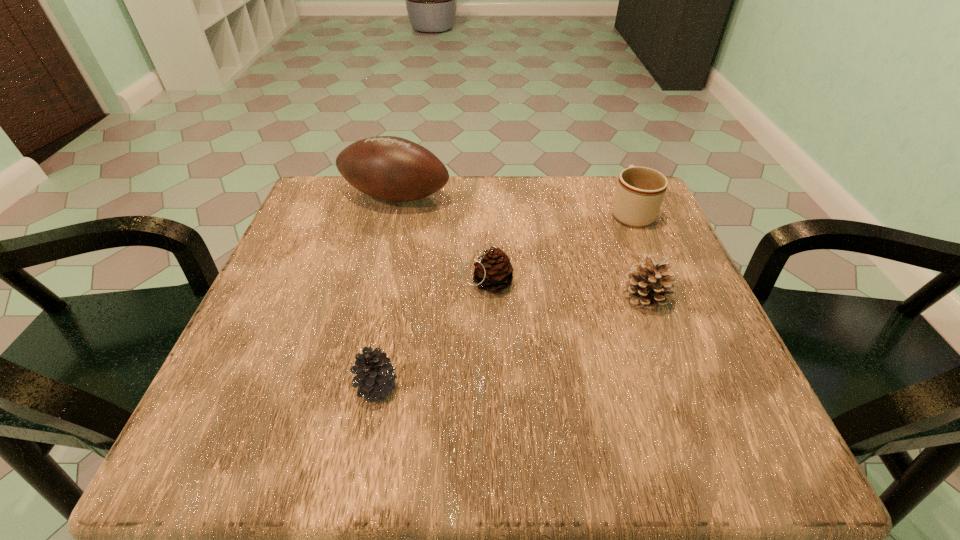
Where is `free space located with a leaf charm attached to the second pinecone from left to right`? free space located with a leaf charm attached to the second pinecone from left to right is located at coordinates (340, 283).

Find the location of a particular element. The width and height of the screenshot is (960, 540). free space located 0.170m on the left of the nearest pinecone is located at coordinates (247, 388).

Locate an element on the screen. football (American) that is at the far edge is located at coordinates (388, 168).

This screenshot has width=960, height=540. I want to click on mug that is at the far edge, so click(640, 191).

The height and width of the screenshot is (540, 960). Find the location of `object positioned at the left edge`. object positioned at the left edge is located at coordinates (388, 168).

I want to click on mug situated at the right edge, so click(640, 191).

Identify the location of pinecone that is at the right edge. The height and width of the screenshot is (540, 960). (647, 284).

Locate an element on the screen. This screenshot has width=960, height=540. object that is positioned at the far left corner is located at coordinates (388, 168).

Locate an element on the screen. The width and height of the screenshot is (960, 540). object that is at the far right corner is located at coordinates (640, 191).

In the image, there is a desktop. At what (x,y) coordinates should I click in order to perform the action: click on vacant space at the far edge. Please return your answer as a coordinate pair (x, y). The image size is (960, 540). Looking at the image, I should click on 581,189.